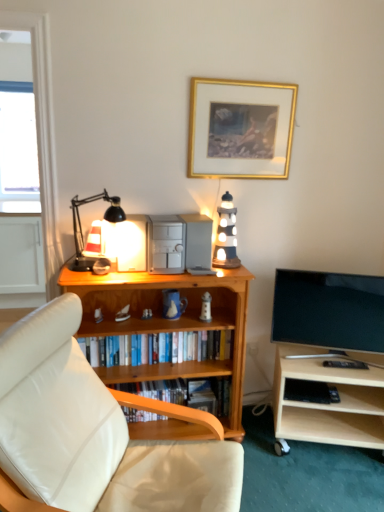
Question: From a real-world perspective, is transparent glass window at upper left physically below black plastic book at lower right, which is the second book from top to bottom?

Choices:
 (A) yes
 (B) no

Answer: (B)

Question: Considering the relative sizes of transparent glass window at upper left and black plastic book at lower right, which is the second book from top to bottom, in the image provided, is transparent glass window at upper left taller than black plastic book at lower right, which is the second book from top to bottom,?

Choices:
 (A) yes
 (B) no

Answer: (A)

Question: Does transparent glass window at upper left have a greater width compared to black plastic book at lower right, acting as the second book starting from the bottom?

Choices:
 (A) no
 (B) yes

Answer: (A)

Question: From a real-world perspective, is transparent glass window at upper left positioned over black plastic book at lower right, acting as the second book starting from the bottom, based on gravity?

Choices:
 (A) no
 (B) yes

Answer: (B)

Question: Is transparent glass window at upper left not within black plastic book at lower right, which is the second book from top to bottom?

Choices:
 (A) no
 (B) yes

Answer: (B)

Question: Is transparent glass window at upper left at the left side of black plastic book at lower right, acting as the second book starting from the bottom?

Choices:
 (A) no
 (B) yes

Answer: (B)

Question: From the image's perspective, does wooden bookcase at center appear lower than matte black table lamp at left?

Choices:
 (A) no
 (B) yes

Answer: (B)

Question: Is wooden bookcase at center bigger than matte black table lamp at left?

Choices:
 (A) no
 (B) yes

Answer: (B)

Question: Is wooden bookcase at center shorter than matte black table lamp at left?

Choices:
 (A) no
 (B) yes

Answer: (A)

Question: Are wooden bookcase at center and matte black table lamp at left located far from each other?

Choices:
 (A) no
 (B) yes

Answer: (A)

Question: Is wooden bookcase at center to the left of matte black table lamp at left from the viewer's perspective?

Choices:
 (A) yes
 (B) no

Answer: (B)

Question: Can you confirm if wooden bookcase at center is wider than matte black table lamp at left?

Choices:
 (A) yes
 (B) no

Answer: (A)

Question: Can you confirm if wooden bookshelf at center, the third book when ordered from top to bottom, is positioned to the left of transparent glass window at upper left?

Choices:
 (A) no
 (B) yes

Answer: (A)